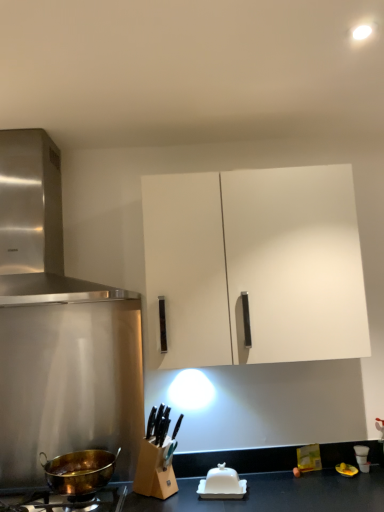
Question: Is gold metallic pot at lower left aimed at gold-bronze wok at lower left?

Choices:
 (A) no
 (B) yes

Answer: (A)

Question: From a real-world perspective, is gold metallic pot at lower left below gold-bronze wok at lower left?

Choices:
 (A) no
 (B) yes

Answer: (B)

Question: Considering the relative positions of gold metallic pot at lower left and gold-bronze wok at lower left in the image provided, is gold metallic pot at lower left to the right of gold-bronze wok at lower left from the viewer's perspective?

Choices:
 (A) no
 (B) yes

Answer: (A)

Question: From the image's perspective, is gold metallic pot at lower left over gold-bronze wok at lower left?

Choices:
 (A) yes
 (B) no

Answer: (B)

Question: Is the surface of gold metallic pot at lower left in direct contact with gold-bronze wok at lower left?

Choices:
 (A) no
 (B) yes

Answer: (B)

Question: Is gold metallic pot at lower left at the left side of gold-bronze wok at lower left?

Choices:
 (A) no
 (B) yes

Answer: (B)

Question: Is white glossy butter dish at lower center looking in the opposite direction of gold metallic pot at lower left?

Choices:
 (A) no
 (B) yes

Answer: (A)

Question: From a real-world perspective, is white glossy butter dish at lower center beneath gold metallic pot at lower left?

Choices:
 (A) no
 (B) yes

Answer: (A)

Question: Does white glossy butter dish at lower center have a lesser width compared to gold metallic pot at lower left?

Choices:
 (A) no
 (B) yes

Answer: (B)

Question: From the image's perspective, is white glossy butter dish at lower center under gold metallic pot at lower left?

Choices:
 (A) no
 (B) yes

Answer: (A)

Question: Is white glossy butter dish at lower center outside of gold metallic pot at lower left?

Choices:
 (A) no
 (B) yes

Answer: (B)

Question: Can you confirm if white glossy butter dish at lower center is positioned to the right of gold metallic pot at lower left?

Choices:
 (A) no
 (B) yes

Answer: (B)

Question: Does stainless steel range hood at upper left have a smaller size compared to gold metallic pot at lower left?

Choices:
 (A) yes
 (B) no

Answer: (B)